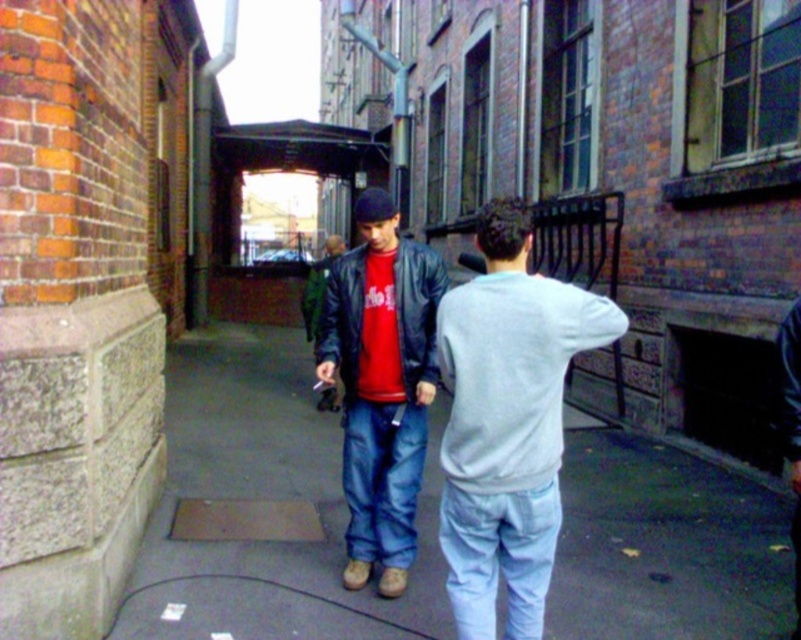
Question: Among these points, which one is nearest to the camera?

Choices:
 (A) (296, 429)
 (B) (308, 310)
 (C) (332, 310)
 (D) (534, 582)

Answer: (D)

Question: Which object appears farthest from the camera in this image?

Choices:
 (A) light gray sweatshirt at center
 (B) matte black jacket at center
 (C) matte black leather jacket at center
 (D) smooth concrete pavement at center

Answer: (D)

Question: Is smooth concrete pavement at center thinner than light gray sweatshirt at center?

Choices:
 (A) no
 (B) yes

Answer: (B)

Question: Which of the following is the farthest from the observer?

Choices:
 (A) matte black leather jacket at center
 (B) matte black jacket at center

Answer: (B)

Question: Does light gray sweatshirt at center have a larger size compared to matte black jacket at center?

Choices:
 (A) yes
 (B) no

Answer: (B)

Question: Does smooth concrete pavement at center appear on the right side of matte black leather jacket at center?

Choices:
 (A) no
 (B) yes

Answer: (B)